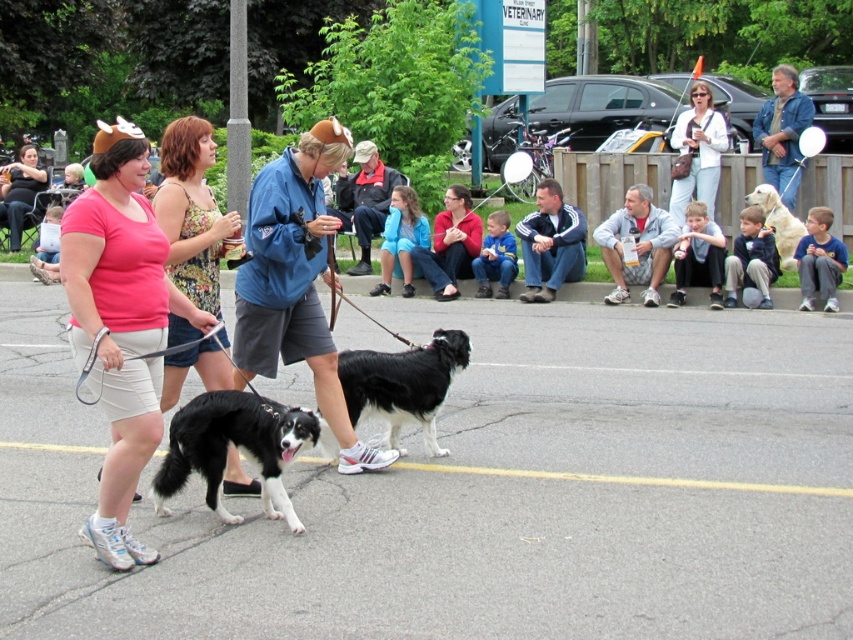
Can you confirm if black and white fur at center is positioned above matte white shirt at upper center?

Actually, black and white fur at center is below matte white shirt at upper center.

Does black and white fur at center have a greater height compared to matte white shirt at upper center?

No, black and white fur at center is not taller than matte white shirt at upper center.

Locate an element on the screen. This screenshot has width=853, height=640. black and white fur at center is located at coordinates (403, 384).

Does blue fabric jacket at center appear on the right side of denim jacket at upper right?

Incorrect, blue fabric jacket at center is not on the right side of denim jacket at upper right.

This screenshot has width=853, height=640. Describe the element at coordinates (294, 282) in the screenshot. I see `blue fabric jacket at center` at that location.

Where is `blue fabric jacket at center`? The image size is (853, 640). blue fabric jacket at center is located at coordinates (294, 282).

Does black and white fur at center have a larger size compared to blue athletic jacket at center?

No, black and white fur at center is not bigger than blue athletic jacket at center.

What do you see at coordinates (403, 384) in the screenshot?
I see `black and white fur at center` at bounding box center [403, 384].

You are a GUI agent. You are given a task and a screenshot of the screen. Output one action in this format:
    pyautogui.click(x=<x>, y=<y>)
    Task: Click on the black and white fur at center
    The image size is (853, 640).
    Given the screenshot: What is the action you would take?
    pyautogui.click(x=403, y=384)